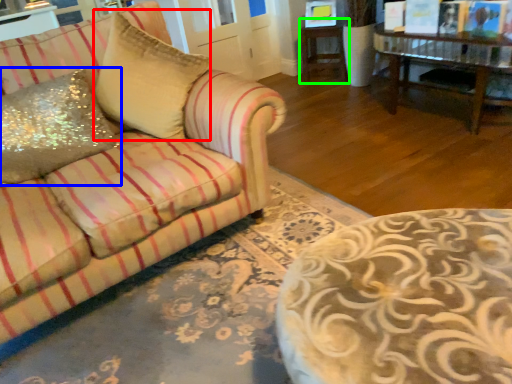
Question: Which is farther away from throw pillow (highlighted by a red box)? throw pillow (highlighted by a blue box) or side table (highlighted by a green box)?

Choices:
 (A) throw pillow
 (B) side table

Answer: (B)